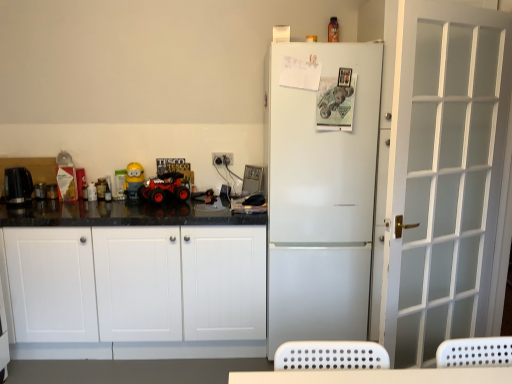
The height and width of the screenshot is (384, 512). I want to click on free location in front of black plastic kettle at left, positioned as the first appliance in back-to-front order, so click(31, 204).